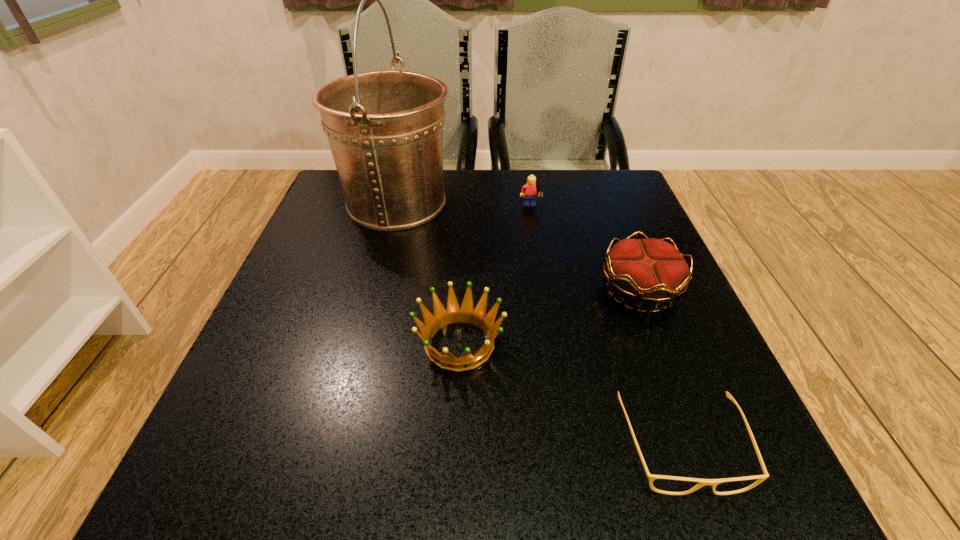
In order to click on vacant area at the near edge in this screenshot , I will do `click(394, 443)`.

In the image, there is a desktop. In order to click on vacant space at the left edge in this screenshot , I will do `click(311, 276)`.

Where is `vacant area at the right edge`? vacant area at the right edge is located at coordinates (611, 326).

Identify the location of free space at the far left corner of the desktop. This screenshot has height=540, width=960. (343, 207).

I want to click on free space at the near left corner of the desktop, so click(x=280, y=510).

What are the coordinates of `vacant space at the far right corner of the desktop` in the screenshot? It's located at (632, 197).

At what (x,y) coordinates should I click in order to perform the action: click on vacant space in between the left crown and the right crown. Please return your answer as a coordinate pair (x, y). The height and width of the screenshot is (540, 960). Looking at the image, I should click on pyautogui.click(x=549, y=317).

The width and height of the screenshot is (960, 540). In order to click on free space that is in between the left crown and the Lego in this screenshot , I will do `click(495, 276)`.

Where is `unoccupied area between the bucket and the spectacles`? unoccupied area between the bucket and the spectacles is located at coordinates (540, 325).

Where is `free point between the second tallest object and the nearest object`? free point between the second tallest object and the nearest object is located at coordinates (606, 328).